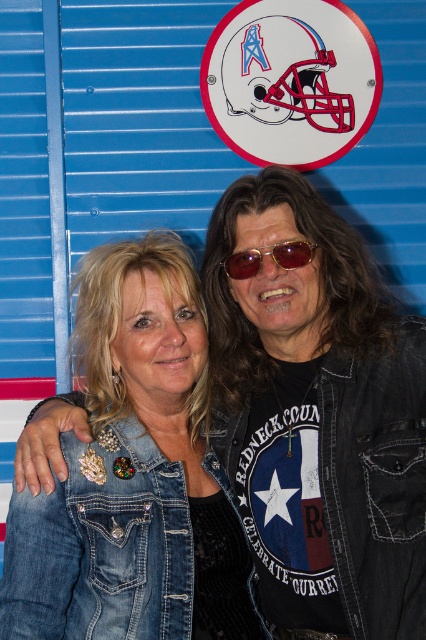
Who is higher up, denim jacket at center or denim jacket at lower right?

Positioned higher is denim jacket at center.

Who is lower down, denim jacket at center or denim jacket at lower right?

denim jacket at lower right is lower down.

Where is `denim jacket at center`? The width and height of the screenshot is (426, 640). denim jacket at center is located at coordinates [x=319, y=416].

The image size is (426, 640). I want to click on denim jacket at center, so click(319, 416).

Is denim jacket at lower right bigger than gold reflective sunglasses at center?

Correct, denim jacket at lower right is larger in size than gold reflective sunglasses at center.

Image resolution: width=426 pixels, height=640 pixels. In order to click on denim jacket at lower right in this screenshot , I will do `click(103, 548)`.

Measure the distance between denim jacket at center and gold reflective sunglasses at center.

A distance of 11.00 inches exists between denim jacket at center and gold reflective sunglasses at center.

Identify the location of denim jacket at center. This screenshot has height=640, width=426. (319, 416).

Where is `denim jacket at center`? The height and width of the screenshot is (640, 426). denim jacket at center is located at coordinates (319, 416).